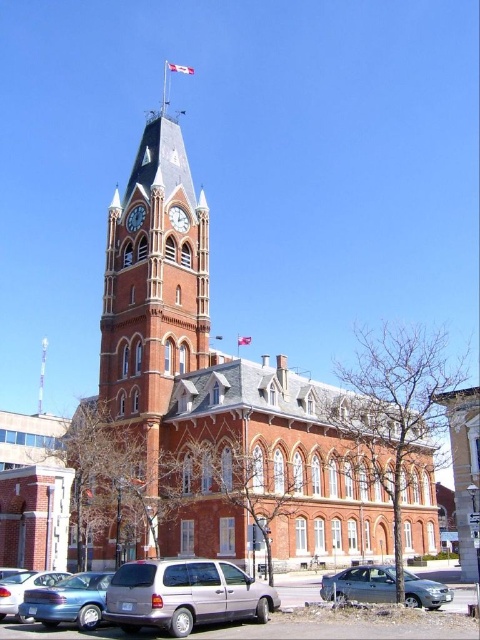
Question: Which object is positioned closest to the metallic silver minivan at lower center?

Choices:
 (A) matte blue sedan at lower left
 (B) brick clock tower at center

Answer: (A)

Question: Does red brick clock tower at center have a lesser width compared to polished brass clock at upper center?

Choices:
 (A) no
 (B) yes

Answer: (A)

Question: Estimate the real-world distances between objects in this image. Which object is farther from the red brick clock tower at center?

Choices:
 (A) red fabric flag at upper center
 (B) metallic gray sedan at lower center
 (C) matte red brick clock tower at upper center

Answer: (A)

Question: Is red brick clock tower at center smaller than matte blue sedan at lower left?

Choices:
 (A) no
 (B) yes

Answer: (A)

Question: Considering the real-world distances, which object is closest to the canadian flag at upper center?

Choices:
 (A) brick clock tower at center
 (B) red brick clock tower at center
 (C) red fabric flag at upper center
 (D) metallic gray sedan at lower center

Answer: (A)

Question: Can you confirm if brick clock tower at center is wider than metallic gray sedan at lower center?

Choices:
 (A) yes
 (B) no

Answer: (A)